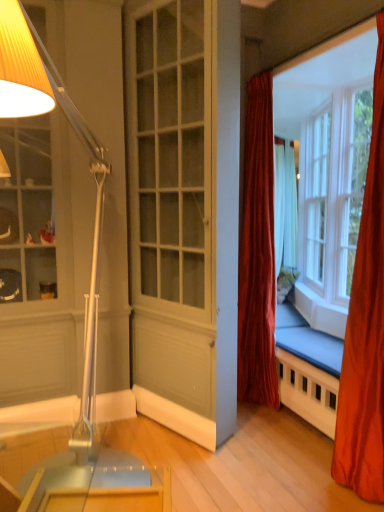
Question: In the image, is white painted wood screen door at center on the left side or the right side of clear glass window at upper right?

Choices:
 (A) right
 (B) left

Answer: (B)

Question: In terms of size, does white painted wood screen door at center appear bigger or smaller than clear glass window at upper right?

Choices:
 (A) big
 (B) small

Answer: (A)

Question: Estimate the real-world distances between objects in this image. Which object is closer to the silky orange curtain at right, the second curtain positioned from the back?

Choices:
 (A) white painted wood screen door at center
 (B) metallic silver lamp at left
 (C) velvet red curtain at center, placed as the first curtain when sorted from back to front
 (D) clear glass window at upper right

Answer: (C)

Question: Which of these objects is positioned closest to the metallic silver lamp at left?

Choices:
 (A) white painted wood screen door at center
 (B) clear glass window at upper right
 (C) velvet red curtain at center, the 2th curtain when ordered from right to left
 (D) silky orange curtain at right, the 1th curtain from the right

Answer: (A)